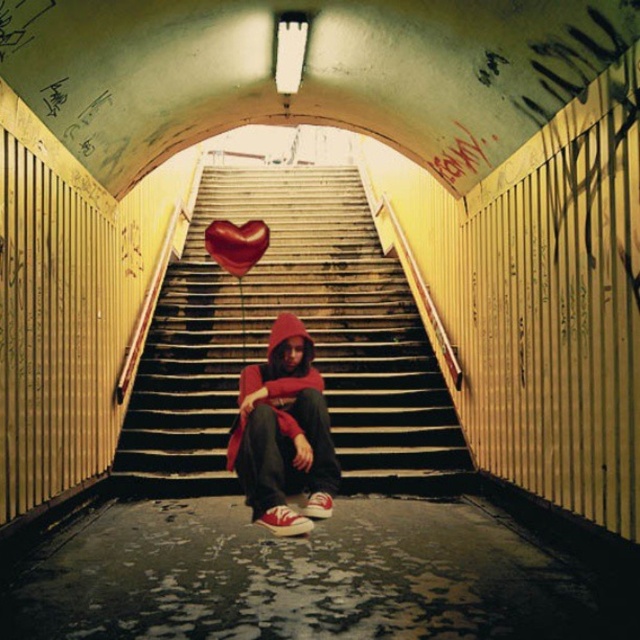
Is smooth concrete stairs at center closer to camera compared to shiny red heart at center?

No, smooth concrete stairs at center is behind shiny red heart at center.

Which is above, smooth concrete stairs at center or shiny red heart at center?

smooth concrete stairs at center is higher up.

Locate an element on the screen. This screenshot has height=640, width=640. smooth concrete stairs at center is located at coordinates (310, 336).

Locate an element on the screen. This screenshot has height=640, width=640. smooth concrete stairs at center is located at coordinates (310, 336).

Does smooth concrete stairs at center appear on the right side of red matte hoodie at center?

Incorrect, smooth concrete stairs at center is not on the right side of red matte hoodie at center.

The width and height of the screenshot is (640, 640). Find the location of `smooth concrete stairs at center`. smooth concrete stairs at center is located at coordinates (310, 336).

What are the coordinates of `smooth concrete stairs at center` in the screenshot? It's located at 310,336.

Which is more to the right, red matte hoodie at center or shiny red heart at center?

red matte hoodie at center

Can you confirm if red matte hoodie at center is positioned above shiny red heart at center?

Incorrect, red matte hoodie at center is not positioned above shiny red heart at center.

This screenshot has height=640, width=640. What do you see at coordinates (284, 433) in the screenshot? I see `red matte hoodie at center` at bounding box center [284, 433].

In order to click on red matte hoodie at center in this screenshot , I will do `click(284, 433)`.